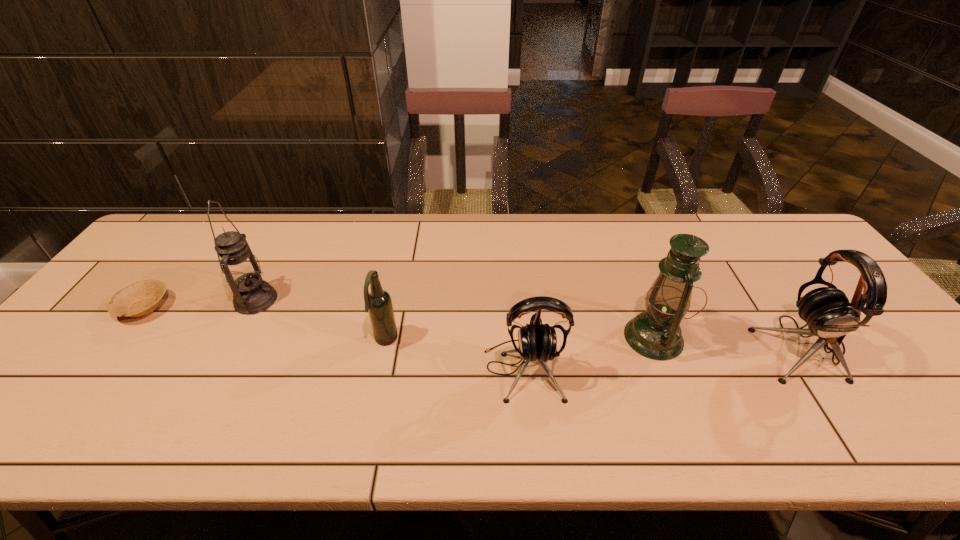
The image size is (960, 540). I want to click on vacant space at the left edge of the desktop, so click(180, 259).

Locate an element on the screen. vacant space at the far left corner is located at coordinates (186, 225).

Where is `vacant point at the near left corner`? The width and height of the screenshot is (960, 540). vacant point at the near left corner is located at coordinates (80, 376).

This screenshot has width=960, height=540. In order to click on free space between the third object from right to left and the second object from right to left in this screenshot , I will do `click(588, 354)`.

Locate an element on the screen. free point between the rightmost object and the right oil lamp is located at coordinates (728, 342).

You are a GUI agent. You are given a task and a screenshot of the screen. Output one action in this format:
    pyautogui.click(x=<x>, y=<y>)
    Task: Click on the vacant area that lies between the shorter earphone and the shortest object
    Image resolution: width=960 pixels, height=540 pixels.
    Given the screenshot: What is the action you would take?
    pyautogui.click(x=334, y=339)

Identify the location of empty location between the right earphone and the shortest object. The image size is (960, 540). (473, 327).

In order to click on free space that is in between the fifth object from right to left and the rightmost object in this screenshot , I will do coord(529,323).

Identify the location of vacant point located between the rightmost object and the fifth object from right to left. Image resolution: width=960 pixels, height=540 pixels. (529, 323).

Where is `free spot between the beer bottle and the rightmost object`? This screenshot has height=540, width=960. free spot between the beer bottle and the rightmost object is located at coordinates (593, 343).